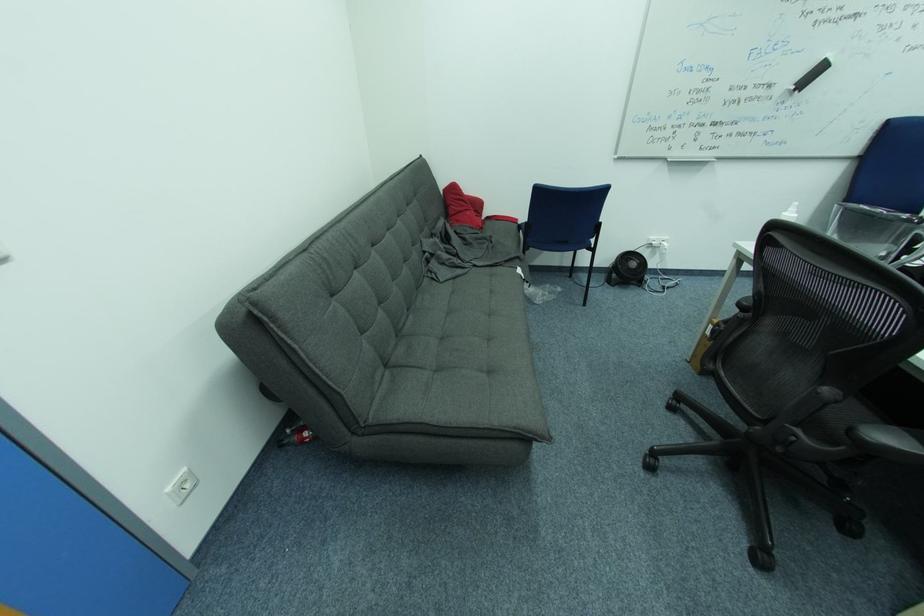
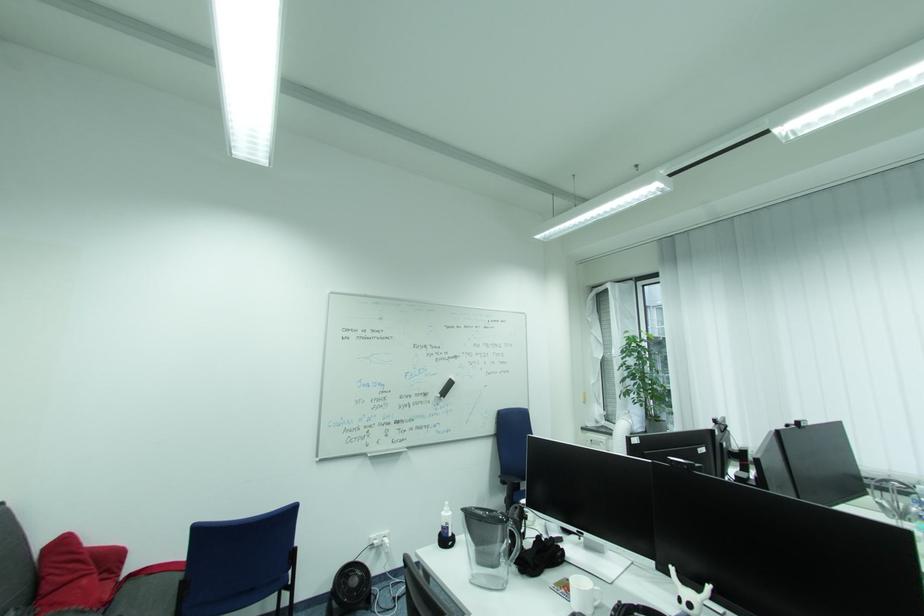
The images are taken continuously from a first-person perspective. In which direction is your viewpoint rotating?

The camera's rotation is toward right-up.